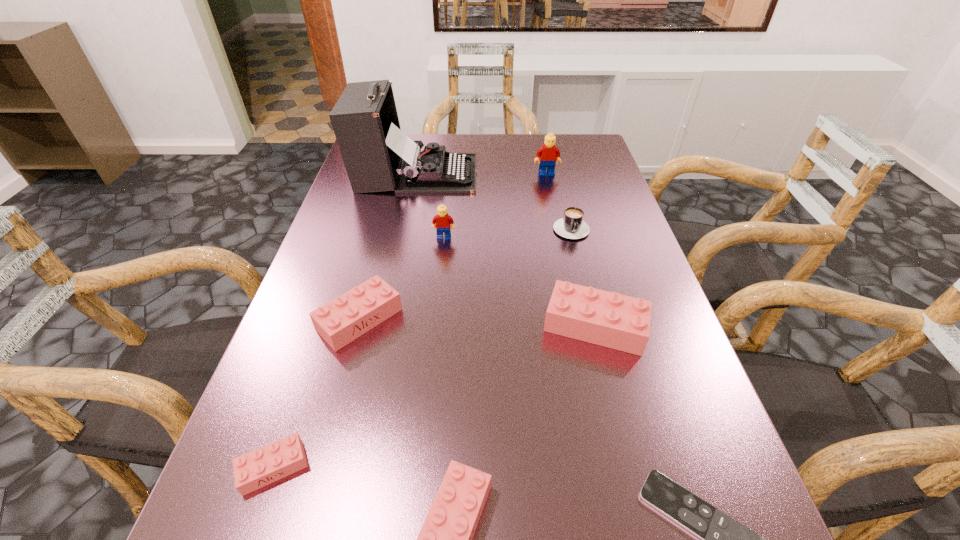
This screenshot has width=960, height=540. I want to click on unoccupied position between the tallest object and the black cappuccino, so click(493, 200).

I want to click on object that is the fourth closest one to the nearer yellow Lego, so click(x=609, y=319).

Identify which object is the fourth closest to the biggest pink Lego. Please provide its 2D coordinates. Your answer should be formatted as a tuple, i.e. [(x, y)], where the tuple contains the x and y coordinates of a point satisfying the conditions above.

[(442, 220)]

The image size is (960, 540). In order to click on the fifth closest Lego to the black cappuccino in this screenshot , I will do `click(445, 539)`.

Locate an element on the screen. Lego that is the third closest one to the cappuccino is located at coordinates (442, 220).

Where is `pink Lego identified as the third closest to the second pink Lego from right to left`? pink Lego identified as the third closest to the second pink Lego from right to left is located at coordinates (609, 319).

Identify which pink Lego is located as the second nearest to the sixth shortest object. Please provide its 2D coordinates. Your answer should be formatted as a tuple, i.e. [(x, y)], where the tuple contains the x and y coordinates of a point satisfying the conditions above.

[(342, 320)]

This screenshot has height=540, width=960. In order to click on vacant space that satisfies the following two spatial constraints: 1. on the front-facing side of the nearer yellow Lego; 2. on the left side of the third tallest Lego in this screenshot , I will do `click(435, 326)`.

Where is `free space that satisfies the following two spatial constraints: 1. on the front-facing side of the smaller yellow Lego; 2. on the left side of the biggest pink Lego`? free space that satisfies the following two spatial constraints: 1. on the front-facing side of the smaller yellow Lego; 2. on the left side of the biggest pink Lego is located at coordinates (435, 326).